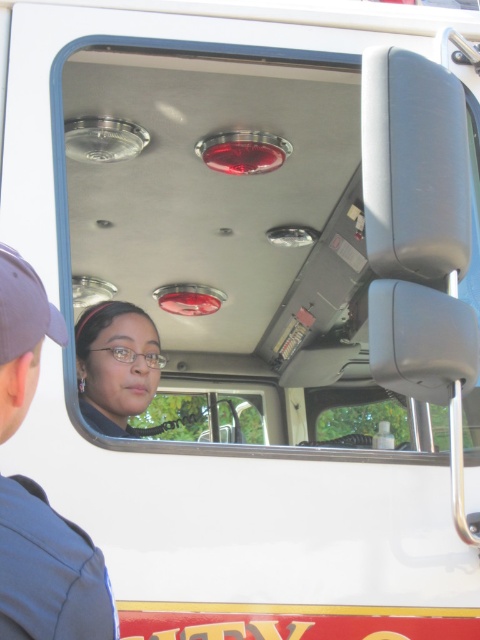
You are a passenger in the fire truck and want to reach both the point at coordinates point (47, 570) and the point at coordinates point (147, 348). Which point should you reach first if you are moving from the driver seat towards the back of the vehicle?

You should reach the point at coordinates point (47, 570) first because it is closer to the camera, which is positioned outside the vehicle looking in, meaning it is closer to the front of the vehicle where the driver seat is located. Since you are moving from the driver seat towards the back, the closer point would be encountered first before reaching the farther point.

You are a passenger in the vehicle and need to reach the blue fabric cap at upper left and the matte black glasses at center. Which object is closer to the ceiling?

The blue fabric cap at upper left is taller than matte black glasses at center, so it is closer to the ceiling.